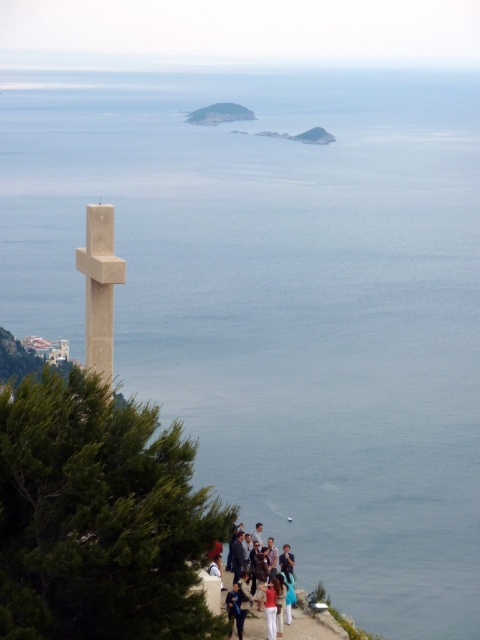
Question: Is smooth concrete cross at center above matte concrete path at lower center?

Choices:
 (A) no
 (B) yes

Answer: (B)

Question: Observing the image, what is the correct spatial positioning of smooth concrete cross at center in reference to matte concrete path at lower center?

Choices:
 (A) below
 (B) above

Answer: (B)

Question: Does matte concrete path at lower center have a larger size compared to blue denim jeans at lower center?

Choices:
 (A) yes
 (B) no

Answer: (A)

Question: Which object appears farthest from the camera in this image?

Choices:
 (A) matte concrete path at lower center
 (B) smooth concrete cross at center
 (C) blue denim jeans at lower center

Answer: (C)

Question: Among these objects, which one is farthest from the camera?

Choices:
 (A) smooth concrete cross at center
 (B) blue denim jeans at lower center
 (C) matte concrete path at lower center

Answer: (B)

Question: Among these points, which one is farthest from the camera?

Choices:
 (A) (259, 625)
 (B) (254, 582)

Answer: (B)